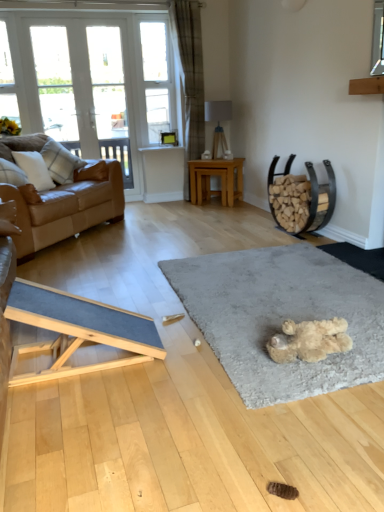
Question: Is point (231, 252) positioned closer to the camera than point (152, 38)?

Choices:
 (A) farther
 (B) closer

Answer: (B)

Question: Based on their sizes in the image, would you say soft gray carpet at center is bigger or smaller than clear glass window screen at upper center?

Choices:
 (A) big
 (B) small

Answer: (A)

Question: Which of these objects is positioned closest to the white textured pillow at left, the 2th pillow viewed from the front?

Choices:
 (A) white glass door at upper left, marked as the second window in a left-to-right arrangement
 (B) wooden ramp at lower left, acting as the second table starting from the right
 (C) white glass screen door at upper left
 (D) soft gray carpet at center
 (E) white glass window at upper left, the 1th window positioned from the left

Answer: (E)

Question: Which of these objects is positioned farthest from the light brown wooden table at center, which is the 2th table in bottom-to-top order?

Choices:
 (A) white glass screen door at upper left
 (B) white glass door at upper left, acting as the second window starting from the right
 (C) white plaid pillow at left, the second pillow from the back
 (D) white glass door at upper left, arranged as the 1th window when viewed from the right
 (E) white glass window at upper left, the 1th window positioned from the left

Answer: (E)